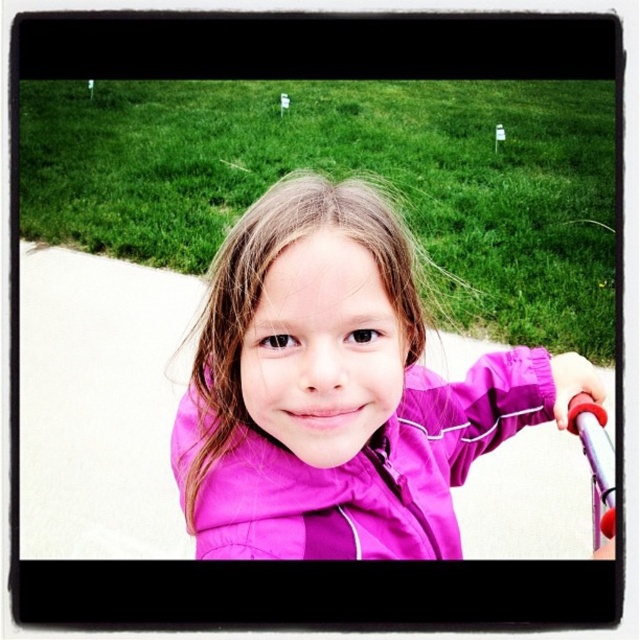
Can you confirm if purple matte jacket at center is positioned above matte purple jacket at center?

Correct, purple matte jacket at center is located above matte purple jacket at center.

Can you confirm if purple matte jacket at center is shorter than matte purple jacket at center?

In fact, purple matte jacket at center may be taller than matte purple jacket at center.

This screenshot has width=640, height=640. What are the coordinates of `purple matte jacket at center` in the screenshot? It's located at (337, 390).